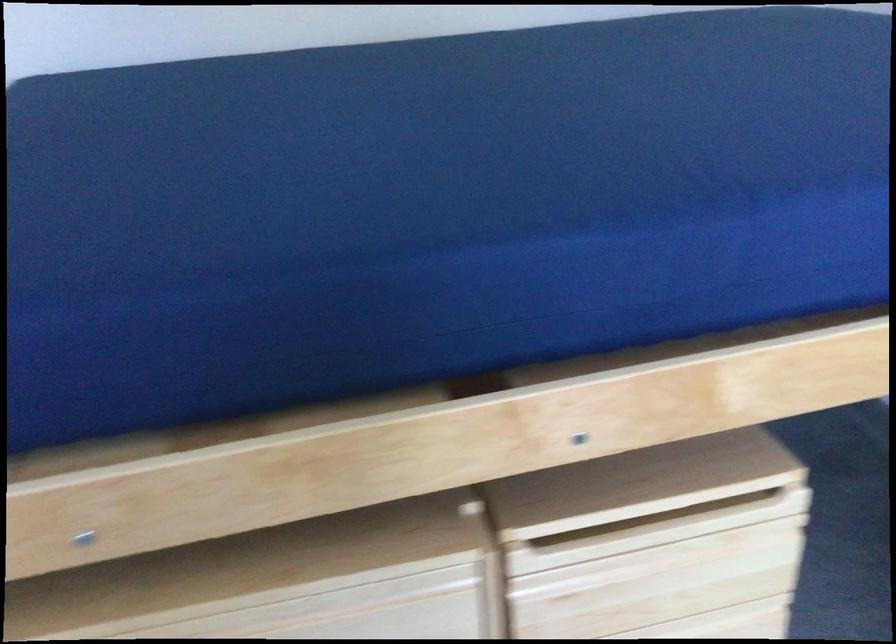
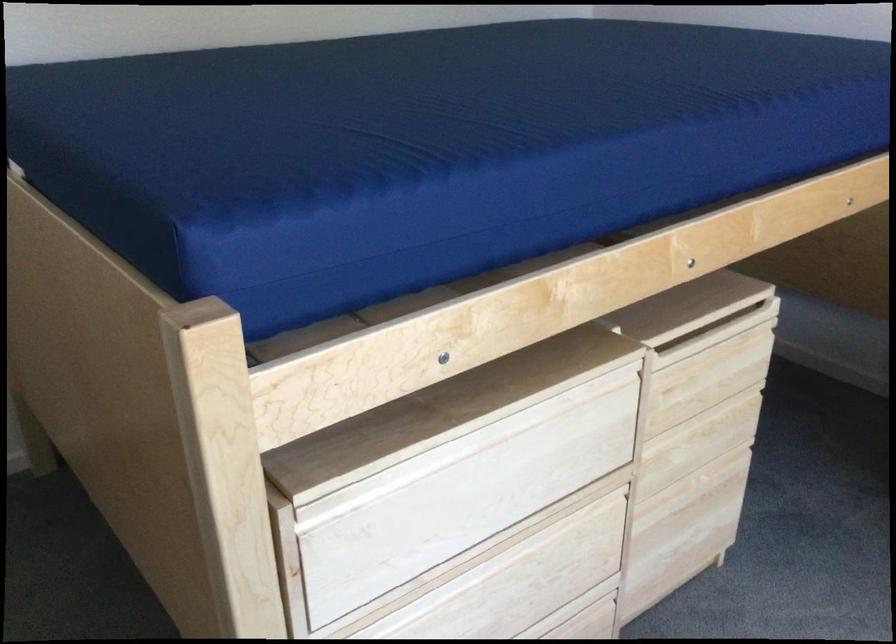
Question: In a continuous first-person perspective shot, in which direction is the camera moving?

Choices:
 (A) Left
 (B) Right
 (C) Forward
 (D) Backward

Answer: (A)